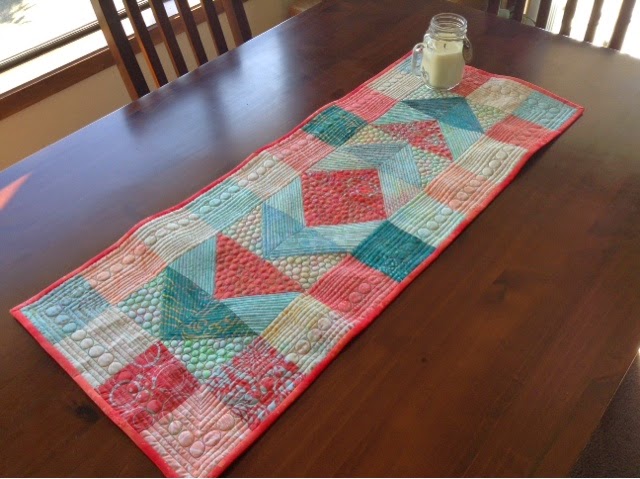
This screenshot has width=640, height=479. What are the coordinates of `polished table` in the screenshot? It's located at (470, 291).